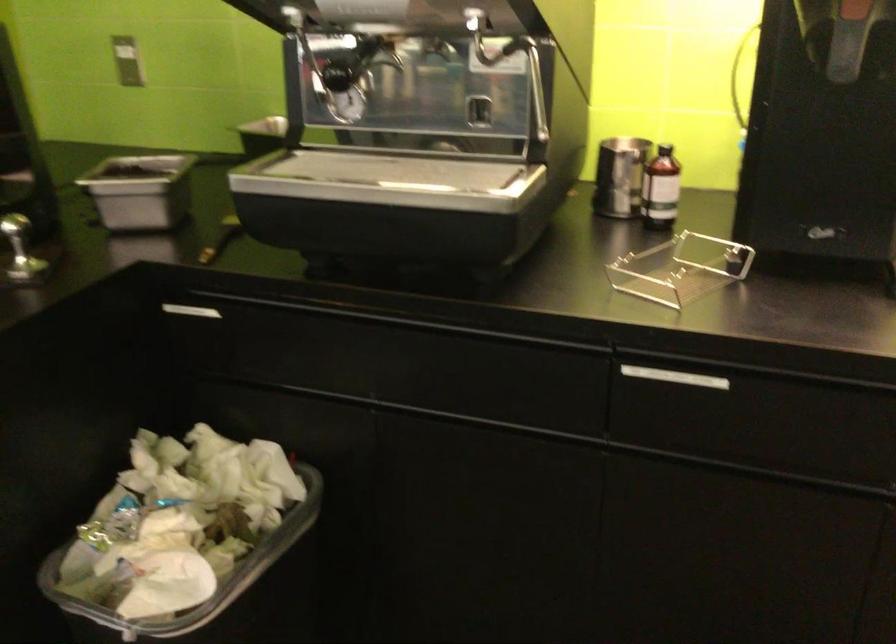
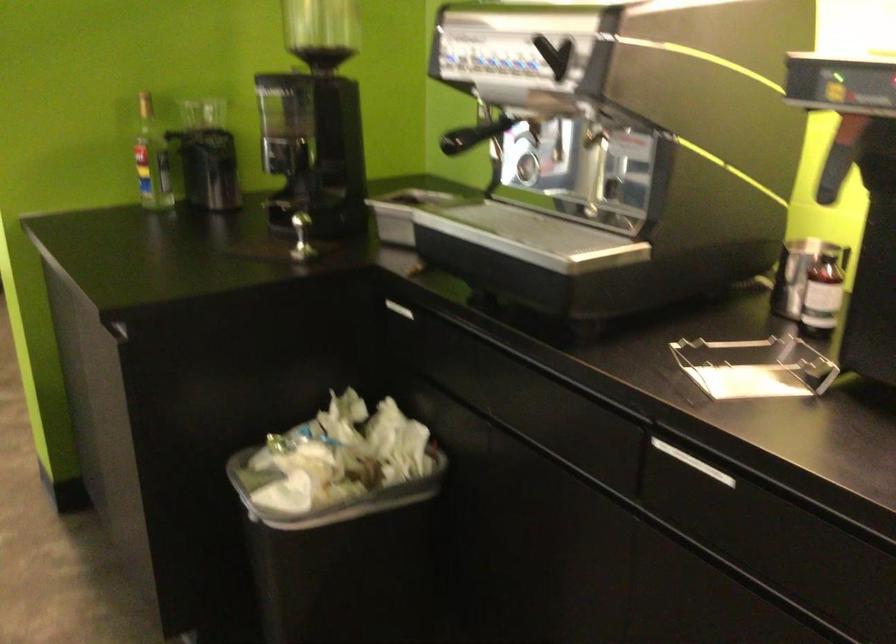
Find the pixel in the second image that matches the point at 208,565 in the first image.

(328, 495)